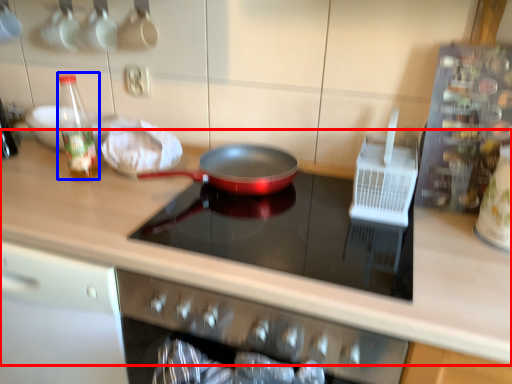
Question: Which object appears closest to the camera in this image, countertop (highlighted by a red box) or bottle (highlighted by a blue box)?

Choices:
 (A) countertop
 (B) bottle

Answer: (A)